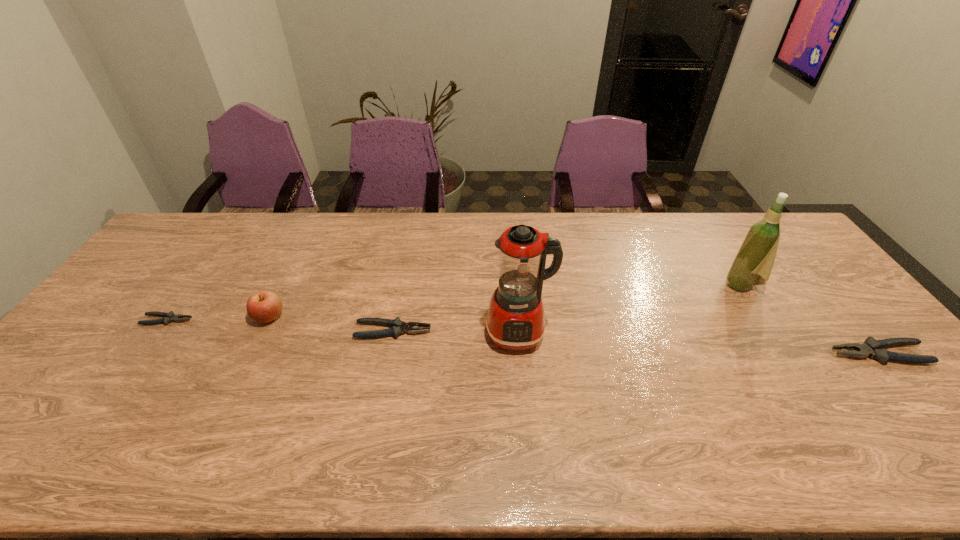
Find the location of a particular element. The image size is (960, 540). the fifth object from right to left is located at coordinates (264, 306).

At what (x,y) coordinates should I click in order to perform the action: click on vacant area situated at the gripping part of the leftmost pliers. Please return your answer as a coordinate pair (x, y). Looking at the image, I should click on (213, 320).

Locate an element on the screen. This screenshot has height=540, width=960. blank space located 0.230m at the gripping part of the second pliers from left to right is located at coordinates (514, 331).

Locate an element on the screen. This screenshot has height=540, width=960. free space located 0.210m at the gripping part of the nearest pliers is located at coordinates (753, 354).

Locate an element on the screen. This screenshot has width=960, height=540. vacant space located 0.400m at the gripping part of the nearest pliers is located at coordinates (682, 354).

At what (x,y) coordinates should I click in order to perform the action: click on vacant space situated 0.240m at the gripping part of the nearest pliers. Please return your answer as a coordinate pair (x, y). The height and width of the screenshot is (540, 960). Looking at the image, I should click on (742, 354).

Where is `vacant point located 0.270m on the front-facing side of the farthest object`? The height and width of the screenshot is (540, 960). vacant point located 0.270m on the front-facing side of the farthest object is located at coordinates [x=637, y=285].

You are a GUI agent. You are given a task and a screenshot of the screen. Output one action in this format:
    pyautogui.click(x=<x>, y=<y>)
    Task: Click on the blank space located 0.320m on the front-facing side of the farthest object
    
    Given the screenshot: What is the action you would take?
    pyautogui.click(x=621, y=285)

Locate an element on the screen. The width and height of the screenshot is (960, 540). free space located on the front-facing side of the farthest object is located at coordinates (692, 285).

Where is `vacant space positioned 0.090m on the controls of the food processor`? The height and width of the screenshot is (540, 960). vacant space positioned 0.090m on the controls of the food processor is located at coordinates pos(523,386).